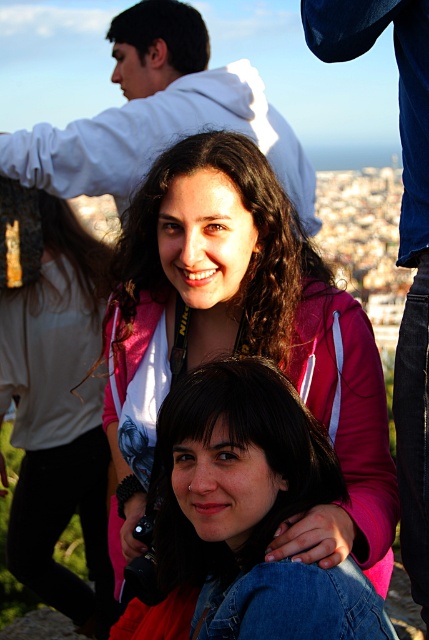
You are planning to take a photo of the cityscape from this vantage point. You notice the pink fleece jacket at center and the white hoodie at upper center in your frame. Which object should you adjust your camera angle to avoid blocking the city view?

The pink fleece jacket at center is much taller than the white hoodie at upper center, so adjusting the camera angle to avoid the pink fleece jacket at center would prevent blocking the city view.

You are a photographer trying to decide which clothing item to use as a prop in your photo shoot. The pink fleece jacket at center and the white hoodie at upper center are both in frame. Which item is narrower in width?

The pink fleece jacket at center is thinner than the white hoodie at upper center, so the pink fleece jacket at center is narrower in width.